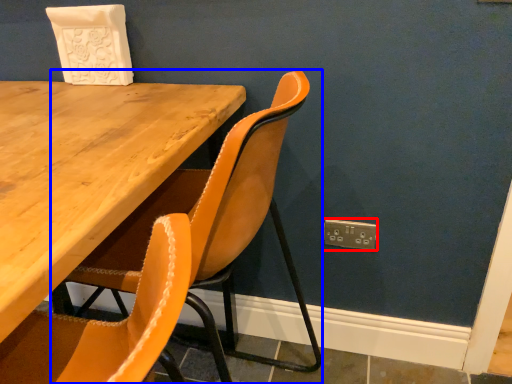
Question: Which of the following is the closest to the observer, electric outlet (highlighted by a red box) or chair (highlighted by a blue box)?

Choices:
 (A) electric outlet
 (B) chair

Answer: (B)